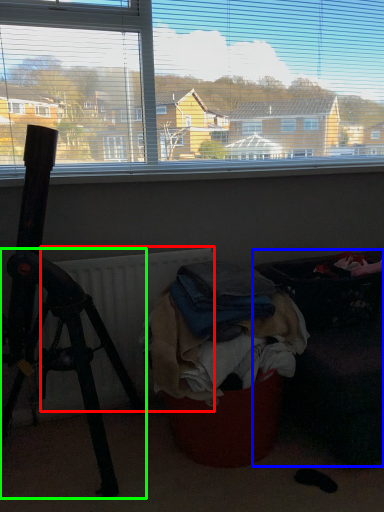
Question: Which is farther away from radiator (highlighted by a red box)? furniture (highlighted by a blue box) or tripod (highlighted by a green box)?

Choices:
 (A) furniture
 (B) tripod

Answer: (A)